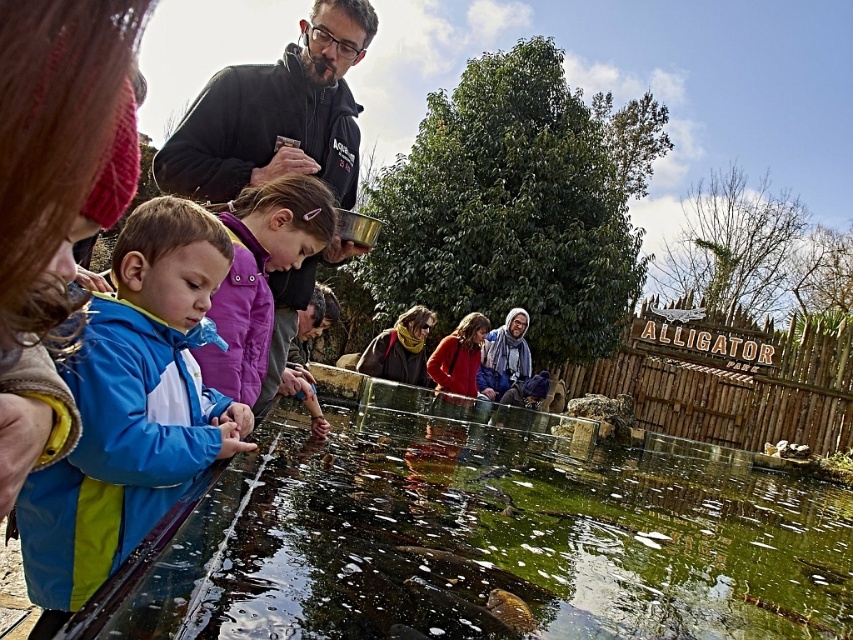
Question: Does green glassy water at lower center appear over blue waterproof jacket at left?

Choices:
 (A) yes
 (B) no

Answer: (B)

Question: Estimate the real-world distances between objects in this image. Which object is farther from the blue waterproof jacket at left?

Choices:
 (A) blue fleece jacket at left
 (B) green glassy water at lower center
 (C) dark gray jacket at upper left

Answer: (C)

Question: Is green glassy water at lower center bigger than blue fleece jacket at left?

Choices:
 (A) yes
 (B) no

Answer: (A)

Question: Is the position of green glassy water at lower center less distant than that of blue waterproof jacket at left?

Choices:
 (A) yes
 (B) no

Answer: (A)

Question: Which point is closer to the camera?

Choices:
 (A) dark gray jacket at upper left
 (B) blue waterproof jacket at left

Answer: (B)

Question: Estimate the real-world distances between objects in this image. Which object is closer to the green glassy water at lower center?

Choices:
 (A) blue fleece jacket at left
 (B) dark gray jacket at upper left

Answer: (A)